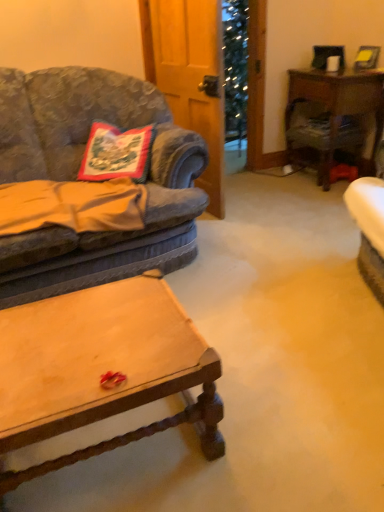
Question: Is velvet fabric couch at left taller than wooden coffee table at center?

Choices:
 (A) no
 (B) yes

Answer: (B)

Question: Can you confirm if velvet fabric couch at left is positioned to the left of wooden coffee table at center?

Choices:
 (A) yes
 (B) no

Answer: (A)

Question: Could you tell me if velvet fabric couch at left is facing wooden coffee table at center?

Choices:
 (A) no
 (B) yes

Answer: (B)

Question: Is velvet fabric couch at left far away from wooden coffee table at center?

Choices:
 (A) yes
 (B) no

Answer: (B)

Question: Is velvet fabric couch at left looking in the opposite direction of wooden coffee table at center?

Choices:
 (A) no
 (B) yes

Answer: (A)

Question: Can we say velvet fabric couch at left lies outside wooden coffee table at center?

Choices:
 (A) yes
 (B) no

Answer: (A)

Question: Is wooden desk at right at the back of embroidered fabric pillow at left?

Choices:
 (A) no
 (B) yes

Answer: (A)

Question: Does embroidered fabric pillow at left have a smaller size compared to wooden desk at right?

Choices:
 (A) no
 (B) yes

Answer: (B)

Question: Can you confirm if embroidered fabric pillow at left is shorter than wooden desk at right?

Choices:
 (A) no
 (B) yes

Answer: (B)

Question: Is embroidered fabric pillow at left wider than wooden desk at right?

Choices:
 (A) no
 (B) yes

Answer: (A)

Question: Is the depth of embroidered fabric pillow at left greater than that of wooden desk at right?

Choices:
 (A) yes
 (B) no

Answer: (B)

Question: Would you say embroidered fabric pillow at left is a long distance from wooden desk at right?

Choices:
 (A) yes
 (B) no

Answer: (A)

Question: From the image's perspective, is wooden desk at right on top of velvet fabric couch at left?

Choices:
 (A) no
 (B) yes

Answer: (B)